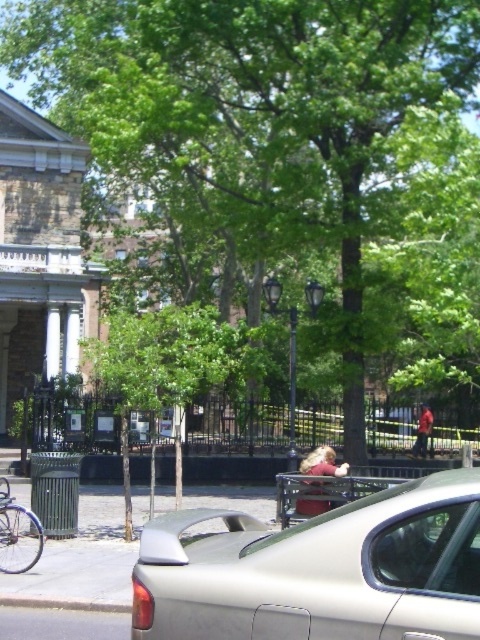
Who is higher up, silver metallic car at center or gray concrete curb at lower left?

Positioned higher is silver metallic car at center.

Is silver metallic car at center thinner than gray concrete curb at lower left?

No.

Which is behind, point (348, 637) or point (84, 604)?

Positioned behind is point (84, 604).

Locate an element on the screen. silver metallic car at center is located at coordinates (320, 570).

Where is `silver metallic bicycle at lower left`? The width and height of the screenshot is (480, 640). silver metallic bicycle at lower left is located at coordinates (17, 534).

Is silver metallic bicycle at lower left positioned behind gray concrete curb at lower left?

That is True.

This screenshot has height=640, width=480. Find the location of `silver metallic bicycle at lower left`. silver metallic bicycle at lower left is located at coordinates (17, 534).

Is silver metallic car at center smaller than silver metallic bicycle at lower left?

Actually, silver metallic car at center might be larger than silver metallic bicycle at lower left.

Does point (457, 637) come closer to viewer compared to point (9, 499)?

Yes, point (457, 637) is closer to viewer.

Find the location of a particular element. The image size is (480, 640). silver metallic car at center is located at coordinates (320, 570).